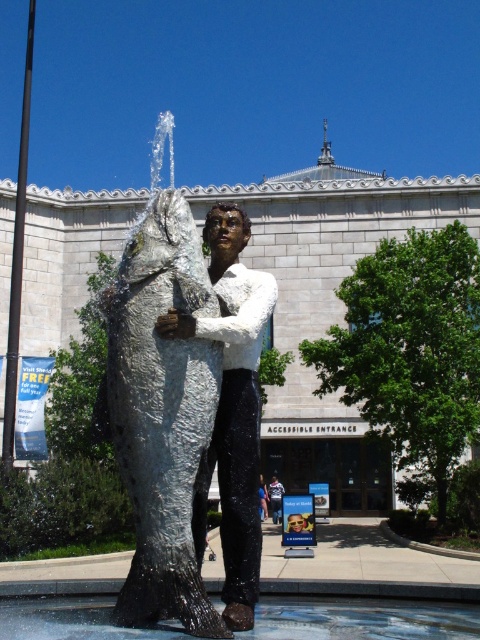
Question: Can you confirm if shiny silver statue at center is smaller than clear water at fountain center?

Choices:
 (A) yes
 (B) no

Answer: (A)

Question: Among these points, which one is nearest to the camera?

Choices:
 (A) (106, 422)
 (B) (224, 380)
 (C) (273, 483)
 (D) (11, 602)

Answer: (A)

Question: Can you confirm if shiny metallic fish at center is bigger than metallic statue at center?

Choices:
 (A) no
 (B) yes

Answer: (B)

Question: Which is nearer to the shiny metallic fish at center?

Choices:
 (A) clear water at fountain center
 (B) shiny silver statue at center
 (C) metallic statue at center

Answer: (B)

Question: Among these points, which one is farthest from the camera?

Choices:
 (A) (108, 612)
 (B) (247, 216)

Answer: (B)

Question: Is shiny metallic fish at center above shiny silver statue at center?

Choices:
 (A) yes
 (B) no

Answer: (A)